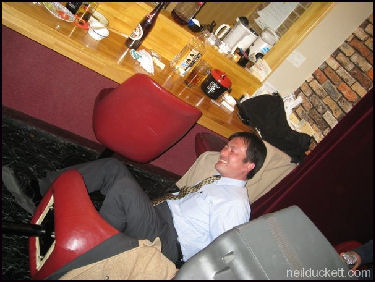
Identify the location of chair. This screenshot has height=282, width=375. [x=75, y=234], [x=125, y=129], [x=207, y=140].